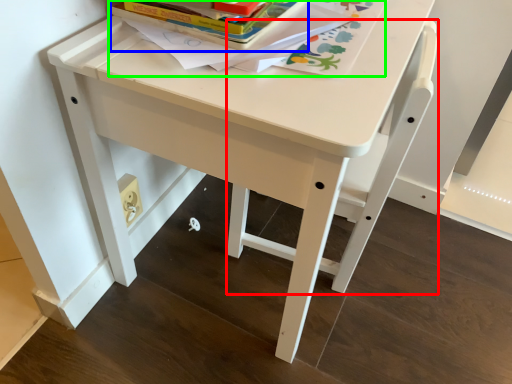
Question: Which object is positioned closest to chair (highlighted by a red box)? Select from paperback book (highlighted by a blue box) and book (highlighted by a green box).

Choices:
 (A) paperback book
 (B) book

Answer: (B)